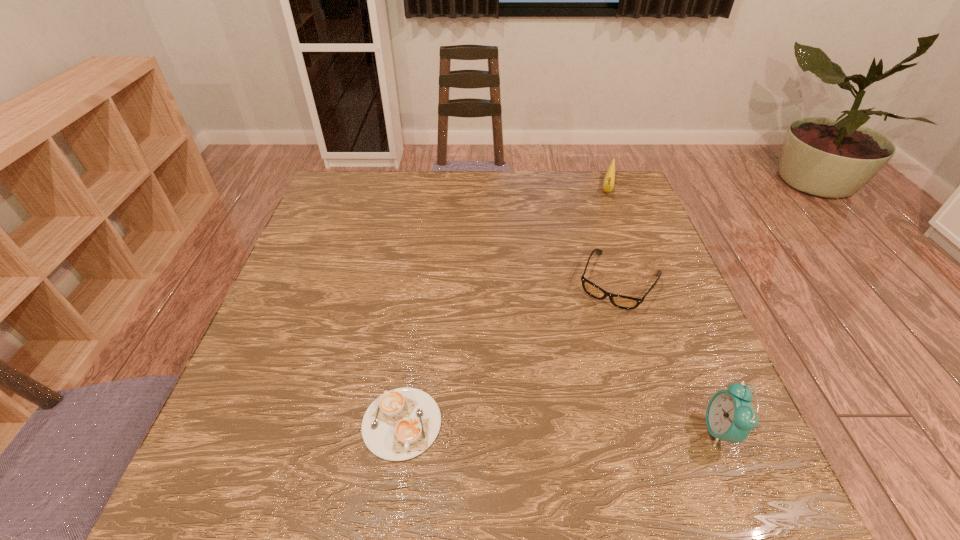
At what (x,y) coordinates should I click in order to perform the action: click on vacant space in between the banana and the leftmost object. Please return your answer as a coordinate pair (x, y). Looking at the image, I should click on pyautogui.click(x=504, y=306).

Locate an element on the screen. The image size is (960, 540). the closest object to the shortest object is located at coordinates point(623,302).

Locate which object is the third closest to the cappuccino. Please provide its 2D coordinates. Your answer should be formatted as a tuple, i.e. [(x, y)], where the tuple contains the x and y coordinates of a point satisfying the conditions above.

[(609, 180)]

Find the location of `free spot that satisfies the following two spatial constraints: 1. on the front side of the farthest object; 2. on the face of the tallest object`. free spot that satisfies the following two spatial constraints: 1. on the front side of the farthest object; 2. on the face of the tallest object is located at coordinates (698, 430).

The width and height of the screenshot is (960, 540). I want to click on vacant area in the image that satisfies the following two spatial constraints: 1. on the back side of the third shortest object; 2. on the right side of the shortest object, so (434, 188).

The width and height of the screenshot is (960, 540). What are the coordinates of `blank area in the image that satisfies the following two spatial constraints: 1. on the front side of the banana; 2. on the face of the alarm clock` in the screenshot? It's located at (698, 430).

At what (x,y) coordinates should I click in order to perform the action: click on free space that satisfies the following two spatial constraints: 1. on the back side of the farthest object; 2. on the right side of the leftmost object. Please return your answer as a coordinate pair (x, y). Looking at the image, I should click on (434, 188).

At what (x,y) coordinates should I click in order to perform the action: click on vacant space that satisfies the following two spatial constraints: 1. on the back side of the spectacles; 2. on the left side of the cappuccino. Please return your answer as a coordinate pair (x, y). The width and height of the screenshot is (960, 540). Looking at the image, I should click on (421, 282).